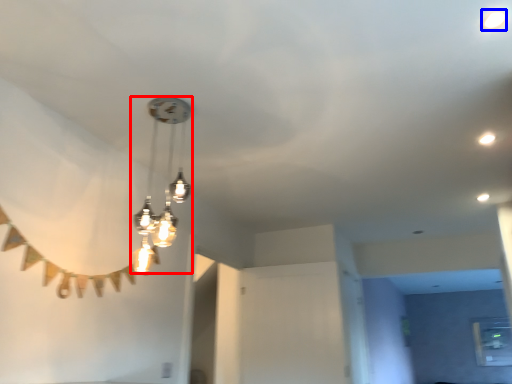
Question: Which point is closer to the camera, lamp (highlighted by a red box) or droplight (highlighted by a blue box)?

Choices:
 (A) lamp
 (B) droplight

Answer: (B)